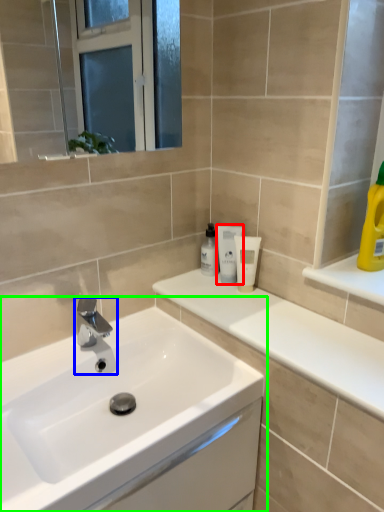
Question: Considering the real-world distances, which object is farthest from mouthwash (highlighted by a red box)? tap (highlighted by a blue box) or sink (highlighted by a green box)?

Choices:
 (A) tap
 (B) sink

Answer: (B)